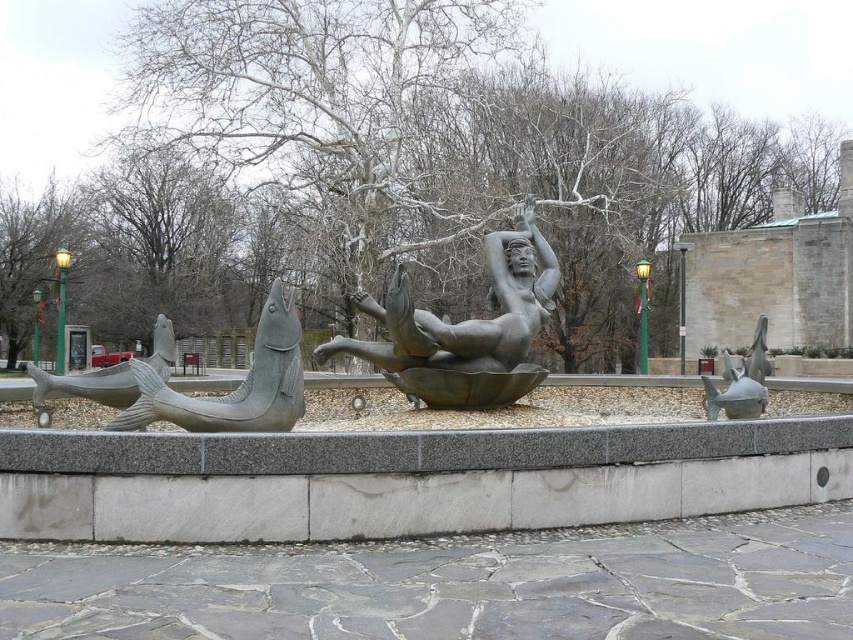
You are standing in the park and want to take a photo of the polished bronze fish at left. If your camera has a maximum focus range of 6 meters, will you need to move closer to get a clear shot?

The distance between the polished bronze fish at left and the viewer is 6.14 meters, which is beyond the camera maximum focus range of 6 meters. You need to move closer to get a clear shot.

You are a maintenance worker inspecting the sculpture. You notice that the gray stone fish at left and the satin silver fish at right are both attached to the base. Which fish is placed higher up on the base?

The gray stone fish at left is positioned over the satin silver fish at right, meaning it is placed higher up on the base.